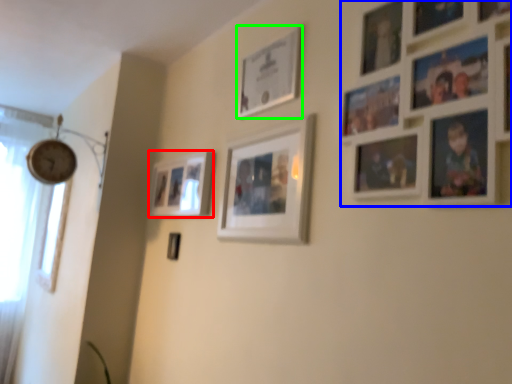
Question: Which object is positioned closest to picture frame (highlighted by a red box)? Select from picture frame (highlighted by a blue box) and picture frame (highlighted by a green box).

Choices:
 (A) picture frame
 (B) picture frame

Answer: (B)